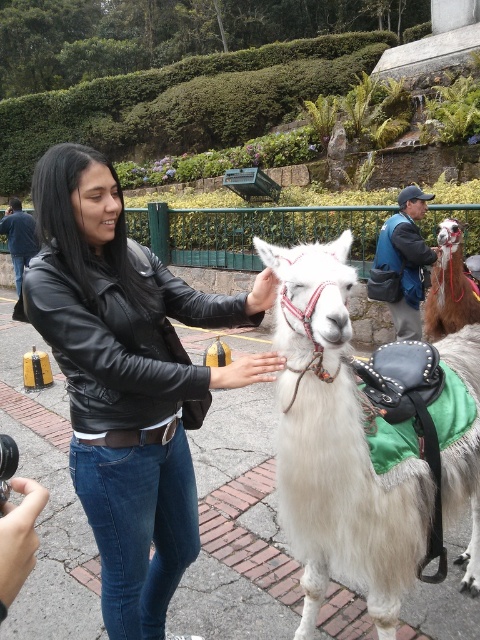
Consider the image. You are a photographer trying to capture the woman and the llama in a photo. You notice the blue denim jacket at center and the matte black hand at upper center. Which object should you focus on first to ensure it appears sharper in the photo?

The blue denim jacket at center should be focused on first because it is closer to the viewer than the matte black hand at upper center, ensuring it will appear sharper in the photo.

You are a photographer trying to capture the woman and the llama in a photo. The blue denim jacket at center is crucial for the composition. Where should you position the jacket in the frame to ensure it appears at the specified 2D location?

The blue denim jacket at center should be positioned at the 2D coordinates point (403, 262) to align with the specified location.